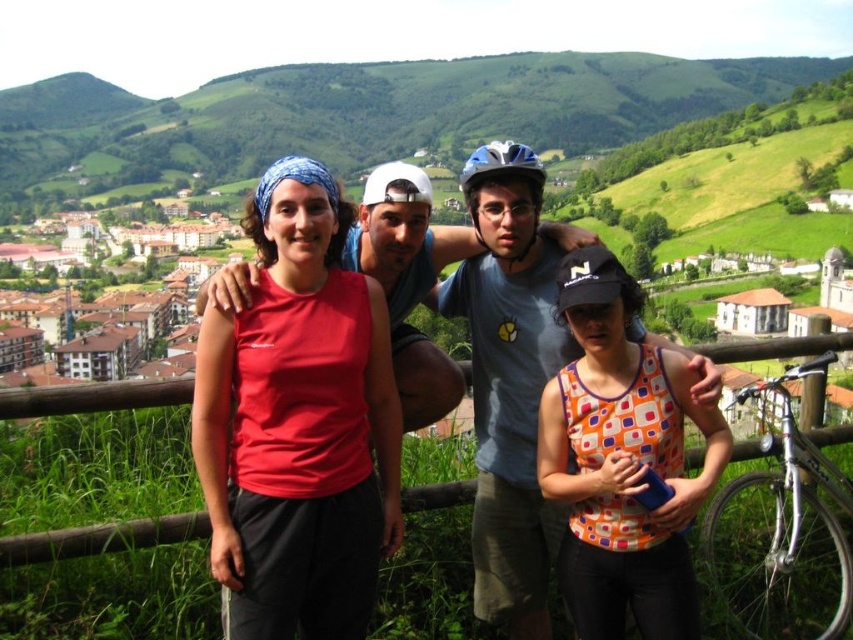
Question: Is orange printed tank top at center thinner than silver metallic helmet at center?

Choices:
 (A) no
 (B) yes

Answer: (B)

Question: Can you confirm if matte red tank top at center is smaller than blue matte bicycle helmet at center?

Choices:
 (A) yes
 (B) no

Answer: (A)

Question: Can you confirm if matte red tank top at center is wider than blue matte bicycle helmet at center?

Choices:
 (A) yes
 (B) no

Answer: (B)

Question: Which of the following is the farthest from the observer?

Choices:
 (A) silver metallic helmet at center
 (B) matte red tank top at center
 (C) orange printed tank top at center

Answer: (A)

Question: Which object is closer to the camera taking this photo?

Choices:
 (A) silver metallic helmet at center
 (B) matte blue helmet at center
 (C) matte red tank top at center
 (D) blue matte bicycle helmet at center

Answer: (C)

Question: Which of the following is the farthest from the observer?

Choices:
 (A) blue matte bicycle helmet at center
 (B) silver metallic helmet at center
 (C) matte blue helmet at center

Answer: (B)